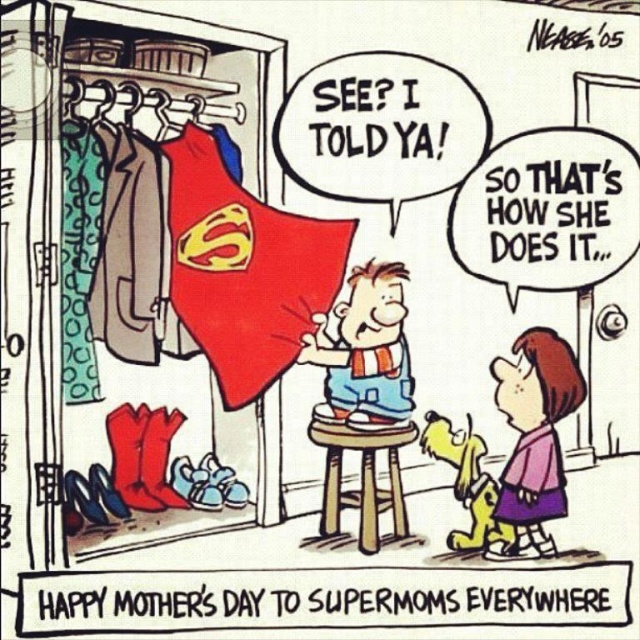
You are helping organize the closet and need to place the smooth blue shorts at center and the wooden stool at center. Based on their sizes, which item should you place first to maximize space efficiency?

The smooth blue shorts at center occupies less space than wooden stool at center, so you should place the wooden stool at center first to make room for the smaller item.

You are a tailor trying to adjust the width of the smooth blue shorts at center so they fit perfectly on the wooden stool at center. Based on the scene, what adjustment should you make?

The smooth blue shorts at center are wider than the wooden stool at center, so you should reduce the width of the smooth blue shorts at center to match the stool.

In the comic strip scene, there are two points marked in the image. The first point is at coordinate [572,392] and the second point is at coordinate [392,301]. From the perspective of someone standing in the room, which point is closer to the viewer?

Point [572,392] is in front of point [392,301], so it is closer to the viewer.